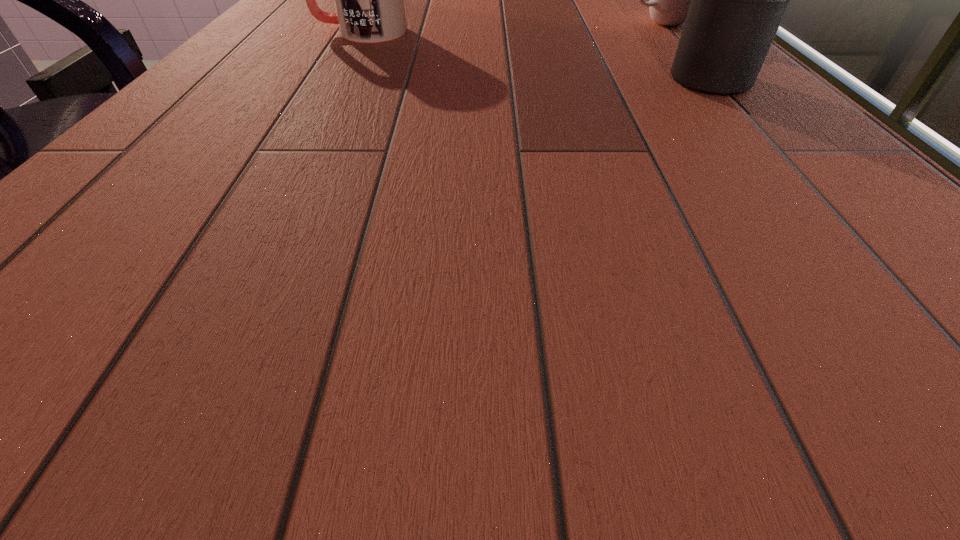
At what (x,y) coordinates should I click in order to perform the action: click on vacant space located 0.190m with the handle on the side of the cup. Please return your answer as a coordinate pair (x, y). Looking at the image, I should click on (544, 37).

Image resolution: width=960 pixels, height=540 pixels. Find the location of `object situated at the left edge`. object situated at the left edge is located at coordinates (369, 4).

At what (x,y) coordinates should I click in order to perform the action: click on jar situated at the right edge. Please return your answer as a coordinate pair (x, y). Looking at the image, I should click on (738, 0).

The width and height of the screenshot is (960, 540). I want to click on cup that is at the right edge, so click(669, 3).

This screenshot has height=540, width=960. I want to click on free space at the near edge, so click(x=493, y=260).

Identify the location of free space at the left edge. The height and width of the screenshot is (540, 960). (66, 217).

Find the location of a particular element. The image size is (960, 540). vacant region at the right edge of the desktop is located at coordinates (874, 184).

Identify the location of free space between the jar and the leftmost object. The height and width of the screenshot is (540, 960). (536, 57).

The image size is (960, 540). What are the coordinates of `vacant space in between the shortest object and the second shortest object` in the screenshot? It's located at pos(510,28).

The width and height of the screenshot is (960, 540). Find the location of `unoccupied area between the leftmost object and the cup`. unoccupied area between the leftmost object and the cup is located at coordinates pos(510,28).